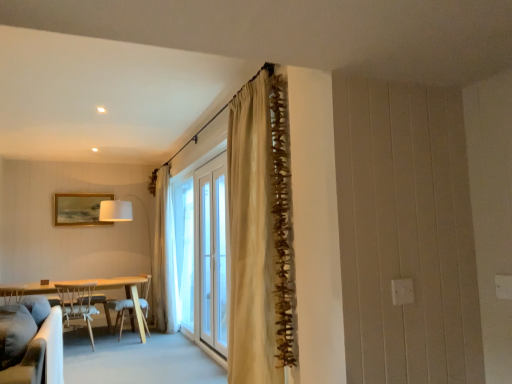
Question: Can you confirm if light wood table at left is positioned to the left of white fabric lampshade at left?

Choices:
 (A) no
 (B) yes

Answer: (B)

Question: Considering the relative sizes of light wood table at left and white fabric lampshade at left in the image provided, is light wood table at left shorter than white fabric lampshade at left?

Choices:
 (A) no
 (B) yes

Answer: (B)

Question: From the image's perspective, is light wood table at left beneath white fabric lampshade at left?

Choices:
 (A) no
 (B) yes

Answer: (B)

Question: Is light wood table at left to the right of white fabric lampshade at left from the viewer's perspective?

Choices:
 (A) yes
 (B) no

Answer: (B)

Question: Is light wood table at left not close to white fabric lampshade at left?

Choices:
 (A) yes
 (B) no

Answer: (A)

Question: Is beige textured curtain at center, placed as the 1th curtain when sorted from left to right, in front of or behind white fabric lampshade at left in the image?

Choices:
 (A) front
 (B) behind

Answer: (B)

Question: Visually, is beige textured curtain at center, which is counted as the 1th curtain, starting from the back, positioned to the left or to the right of white fabric lampshade at left?

Choices:
 (A) right
 (B) left

Answer: (A)

Question: Is point (170, 322) positioned closer to the camera than point (126, 220)?

Choices:
 (A) closer
 (B) farther

Answer: (A)

Question: From the image's perspective, is beige textured curtain at center, which is counted as the 1th curtain, starting from the back, located above or below white fabric lampshade at left?

Choices:
 (A) above
 (B) below

Answer: (A)

Question: Is soft gray fabric couch at lower left bigger or smaller than white glass screen door at center?

Choices:
 (A) small
 (B) big

Answer: (B)

Question: Considering the positions of soft gray fabric couch at lower left and white glass screen door at center in the image, is soft gray fabric couch at lower left wider or thinner than white glass screen door at center?

Choices:
 (A) thin
 (B) wide

Answer: (B)

Question: Would you say soft gray fabric couch at lower left is inside or outside white glass screen door at center?

Choices:
 (A) inside
 (B) outside

Answer: (B)

Question: Relative to white glass screen door at center, is soft gray fabric couch at lower left in front or behind?

Choices:
 (A) front
 (B) behind

Answer: (A)

Question: Considering the positions of white wood chair at left, which is the 2th chair in back-to-front order, and soft gray fabric couch at lower left in the image, is white wood chair at left, which is the 2th chair in back-to-front order, taller or shorter than soft gray fabric couch at lower left?

Choices:
 (A) tall
 (B) short

Answer: (A)

Question: Visually, is white wood chair at left, which is the 2th chair in back-to-front order, positioned to the left or to the right of soft gray fabric couch at lower left?

Choices:
 (A) left
 (B) right

Answer: (A)